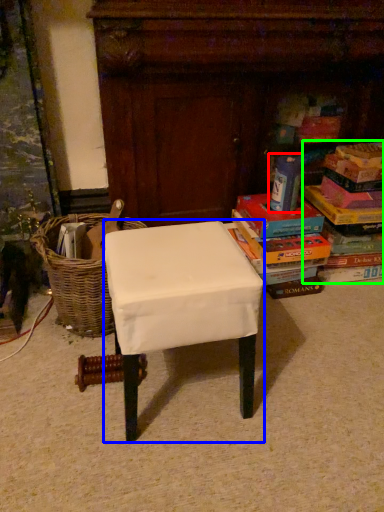
Question: Which object is positioned closest to paperback book (highlighted by a red box)? Select from stool (highlighted by a blue box) and book (highlighted by a green box).

Choices:
 (A) stool
 (B) book

Answer: (B)